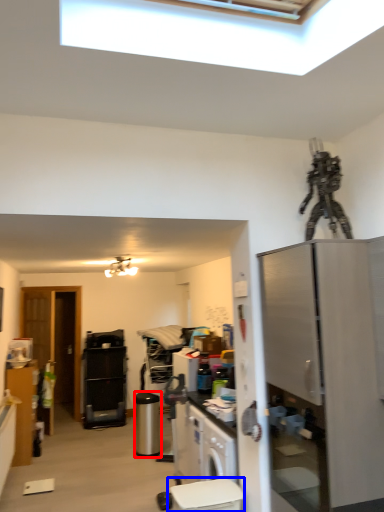
Question: Which point is closer to the camera, appliance (highlighted by a red box) or toilet bowl (highlighted by a blue box)?

Choices:
 (A) appliance
 (B) toilet bowl

Answer: (B)